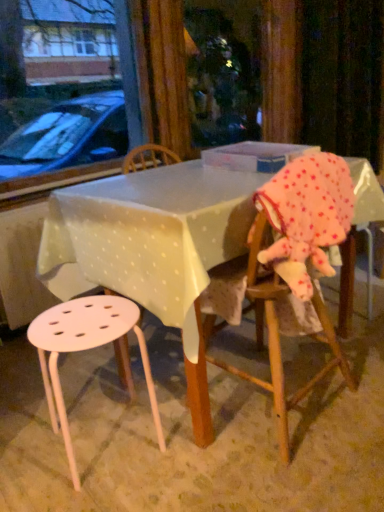
Where is `free spot behind white plastic stool at lower left`? The height and width of the screenshot is (512, 384). free spot behind white plastic stool at lower left is located at coordinates (112, 387).